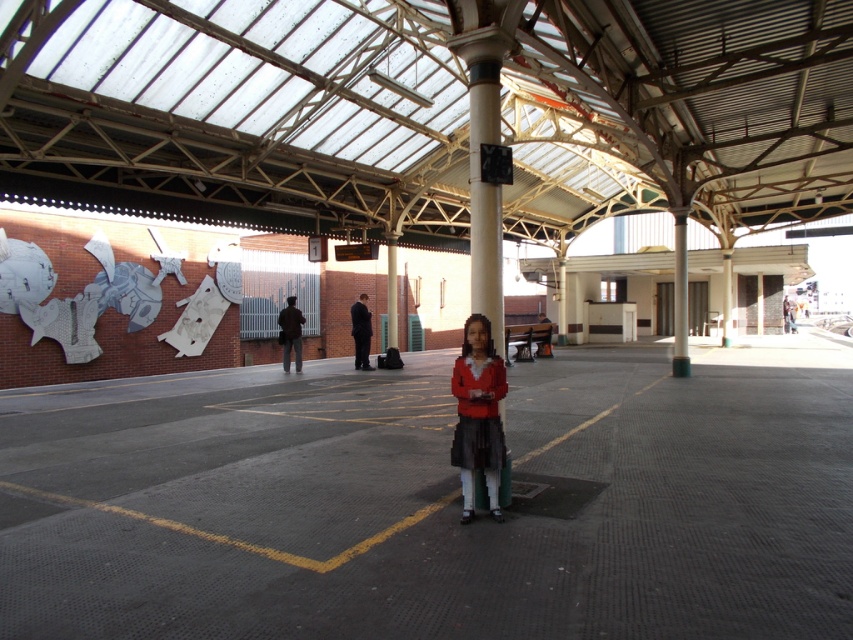
Which is behind, point (306, 563) or point (674, 256)?

The point (674, 256) is more distant.

Which is in front, point (561, 493) or point (683, 246)?

Point (561, 493) is in front.

Does point (572, 582) lie in front of point (677, 208)?

Yes, point (572, 582) is in front of point (677, 208).

Locate an element on the screen. This screenshot has height=640, width=853. smooth asphalt parking lot at center is located at coordinates pyautogui.click(x=437, y=500).

Which is above, matte red sweater at center or metallic pole at center?

metallic pole at center is higher up.

Identify the location of matte red sweater at center. The height and width of the screenshot is (640, 853). (479, 416).

Can you confirm if smooth asphalt parking lot at center is positioned to the left of matte red sweater at center?

In fact, smooth asphalt parking lot at center is to the right of matte red sweater at center.

At what (x,y) coordinates should I click in order to perform the action: click on smooth asphalt parking lot at center. Please return your answer as a coordinate pair (x, y). Looking at the image, I should click on (437, 500).

This screenshot has width=853, height=640. Identify the location of smooth asphalt parking lot at center. (437, 500).